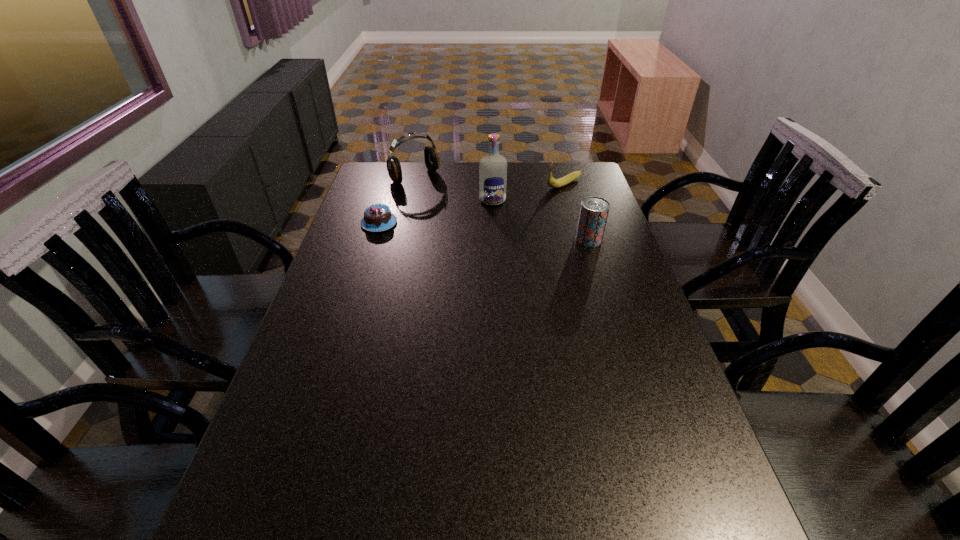
Locate an element on the screen. headset present at the left edge is located at coordinates (432, 161).

Where is `beer can present at the right edge`? beer can present at the right edge is located at coordinates (594, 210).

At what (x,y) coordinates should I click in order to perform the action: click on banana at the right edge. Please return your answer as a coordinate pair (x, y). The height and width of the screenshot is (540, 960). Looking at the image, I should click on (552, 182).

I want to click on object located in the far left corner section of the desktop, so click(x=432, y=161).

Identify the location of object that is positioned at the far right corner. Image resolution: width=960 pixels, height=540 pixels. (552, 182).

The width and height of the screenshot is (960, 540). In the image, there is a desktop. In order to click on vacant area at the near edge in this screenshot , I will do `click(473, 488)`.

Where is `vacant space at the left edge of the desktop`? vacant space at the left edge of the desktop is located at coordinates (329, 262).

What are the coordinates of `free space at the right edge` in the screenshot? It's located at (622, 241).

Identify the location of vacant space at the far left corner of the desktop. Image resolution: width=960 pixels, height=540 pixels. (377, 173).

You are a GUI agent. You are given a task and a screenshot of the screen. Output one action in this format:
    pyautogui.click(x=<x>, y=<y>)
    Task: Click on the vacant region at the far right corner
    This screenshot has height=540, width=960.
    Given the screenshot: What is the action you would take?
    pyautogui.click(x=579, y=168)